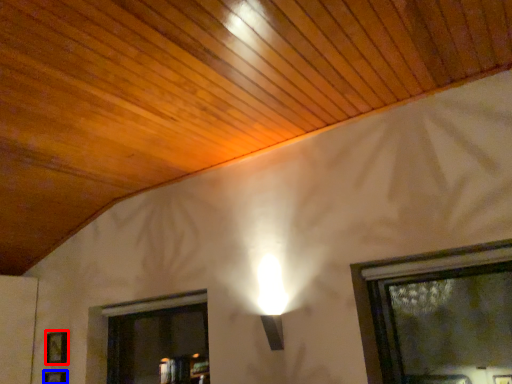
Question: Which of the following is the closest to the observer, picture frame (highlighted by a red box) or picture frame (highlighted by a blue box)?

Choices:
 (A) picture frame
 (B) picture frame

Answer: (B)